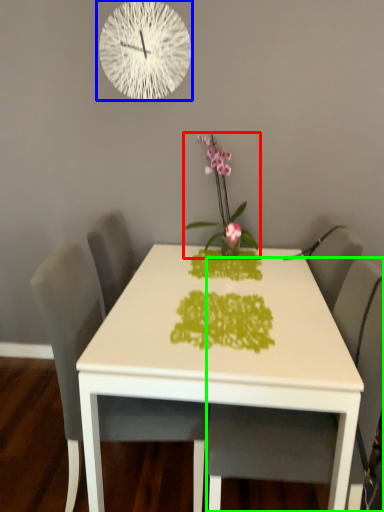
Question: Which is farther away from houseplant (highlighted by a red box)? wall clock (highlighted by a blue box) or chair (highlighted by a green box)?

Choices:
 (A) wall clock
 (B) chair

Answer: (B)